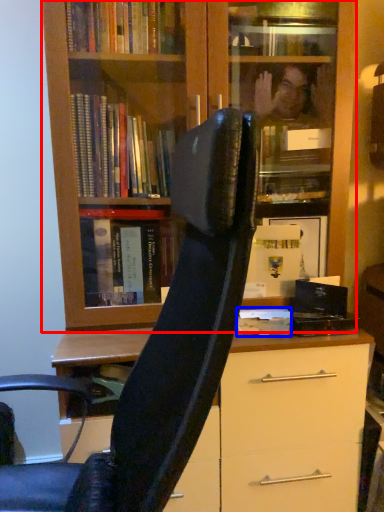
Question: Among these objects, which one is farthest to the camera, bookcase (highlighted by a red box) or paperback book (highlighted by a blue box)?

Choices:
 (A) bookcase
 (B) paperback book

Answer: (B)